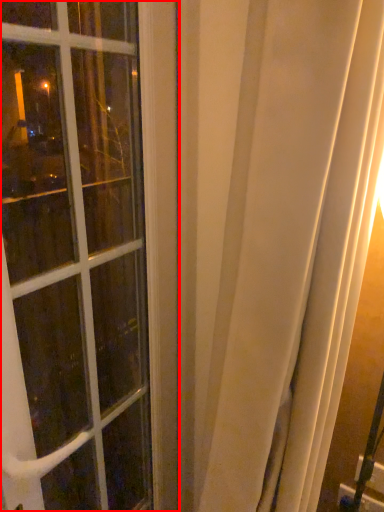
Question: Observing the image, what is the correct spatial positioning of window (annotated by the red box) in reference to curtain?

Choices:
 (A) right
 (B) left

Answer: (B)